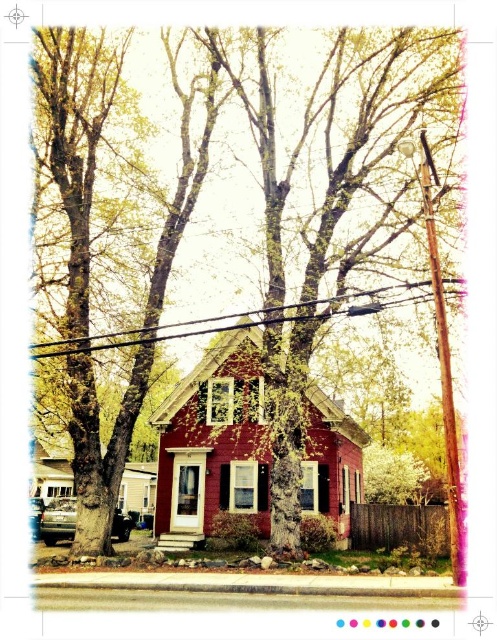
You are standing in front of the red house with a steeply pitched roof and want to locate the smooth bark tree at center. According to the 2D coordinates provided, where would you find it in the image?

The smooth bark tree at center is located at the 2D coordinates point (313, 246) in the image.

You are a birdhouse installer who needs to place a new birdhouse between the smooth bark tree at center and the black wire at upper center. The birdhouse requires at least 8 feet of space between the tree and the wire to be safely installed. Can you install it there?

The distance between the smooth bark tree at center and the black wire at upper center is 7.91 feet, which is less than the required 8 feet. Therefore, the birdhouse cannot be safely installed in that location.